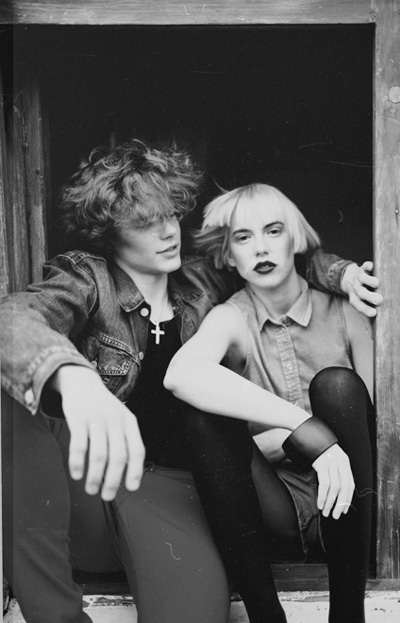
Find the location of a particular element. crucifix is located at coordinates (158, 331).